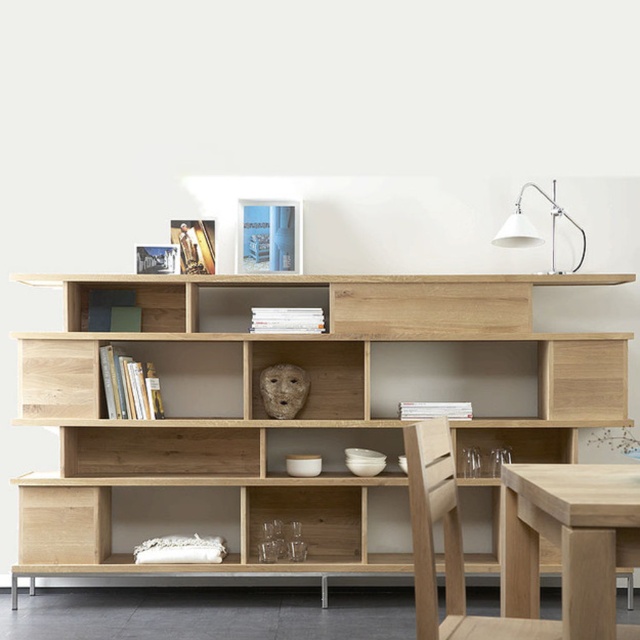
In the scene shown: Which is below, light oak table at center or white matte desk lamp at upper right?

light oak table at center is below.

Between light oak table at center and white matte desk lamp at upper right, which one has less height?

light oak table at center is shorter.

Measure the distance between point (552, 486) and camera.

They are 4.56 feet apart.

At what (x,y) coordinates should I click in order to perform the action: click on light oak table at center. Please return your answer as a coordinate pair (x, y). The height and width of the screenshot is (640, 640). Looking at the image, I should click on (568, 540).

Between light oak table at center and light wood chair at lower right, which one appears on the left side from the viewer's perspective?

From the viewer's perspective, light wood chair at lower right appears more on the left side.

Who is higher up, light oak table at center or light wood chair at lower right?

light oak table at center is higher up.

What do you see at coordinates (568, 540) in the screenshot? The image size is (640, 640). I see `light oak table at center` at bounding box center [568, 540].

You are a GUI agent. You are given a task and a screenshot of the screen. Output one action in this format:
    pyautogui.click(x=<x>, y=<y>)
    Task: Click on the light oak table at center
    The width and height of the screenshot is (640, 640).
    Given the screenshot: What is the action you would take?
    pyautogui.click(x=568, y=540)

Looking at this image, is natural wood bookcase at center bigger than light wood chair at lower right?

Yes.

Can you confirm if natural wood bookcase at center is positioned to the left of light wood chair at lower right?

Yes, natural wood bookcase at center is to the left of light wood chair at lower right.

Does point (513, 280) come in front of point (524, 632)?

No, it is not.

Find the location of `natural wood bookcase at center`. natural wood bookcase at center is located at coordinates [x=289, y=419].